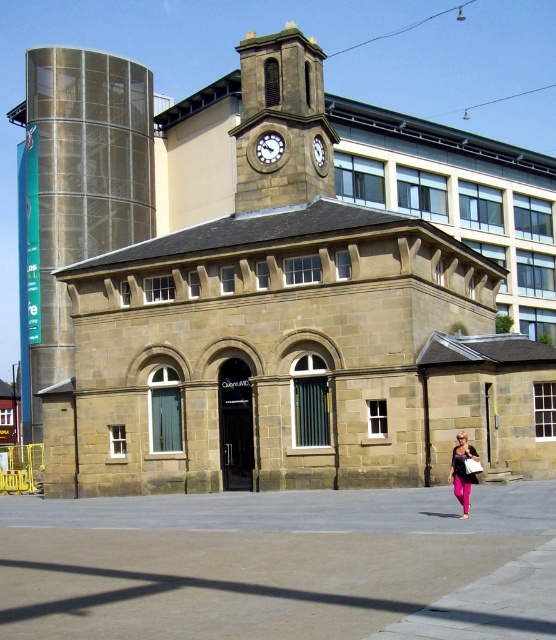
From the picture: You are standing in front of the historic stone building and want to take a photo of both the brass textured clock at center and the white stone clock at upper center. Which clock should you focus on first to ensure both are in the frame?

You should focus on the brass textured clock at center first because it is closer to you than the white stone clock at upper center, so adjusting the focus to include both would require starting with the closer one.

You are standing in front of the historic stone building with a clock tower. You see two points marked on the ground in front of you. The first point is at coordinates point (458,445) and the second is at point (320,163). Which point is closer to you?

Point (458,445) is closer to the viewer than point (320,163).

Based on the photo, you are standing at the entrance of the historic stone building with a clock tower. You see the pink fabric pants at lower right. Where exactly are they located in relation to the building?

The pink fabric pants at lower right are located at point (463, 472) relative to the building.